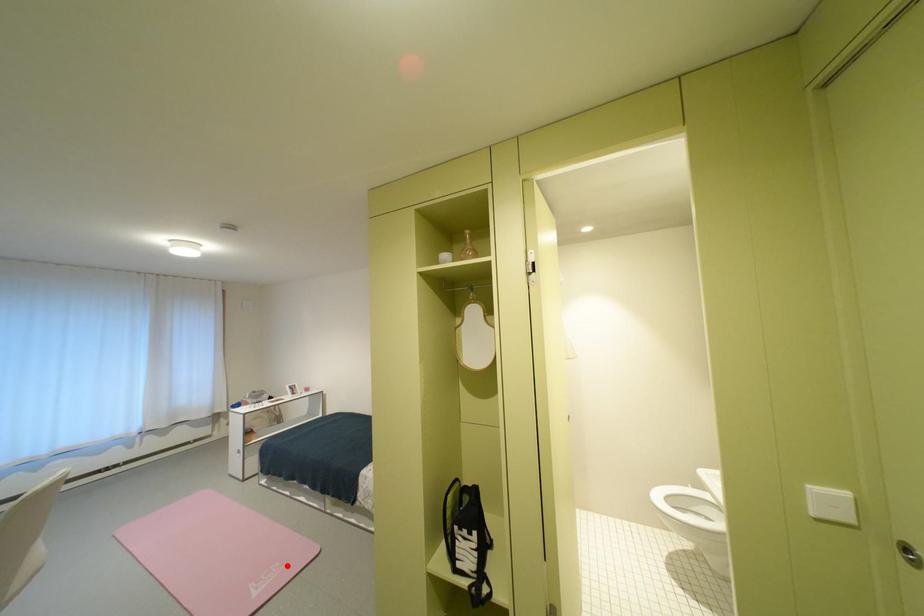
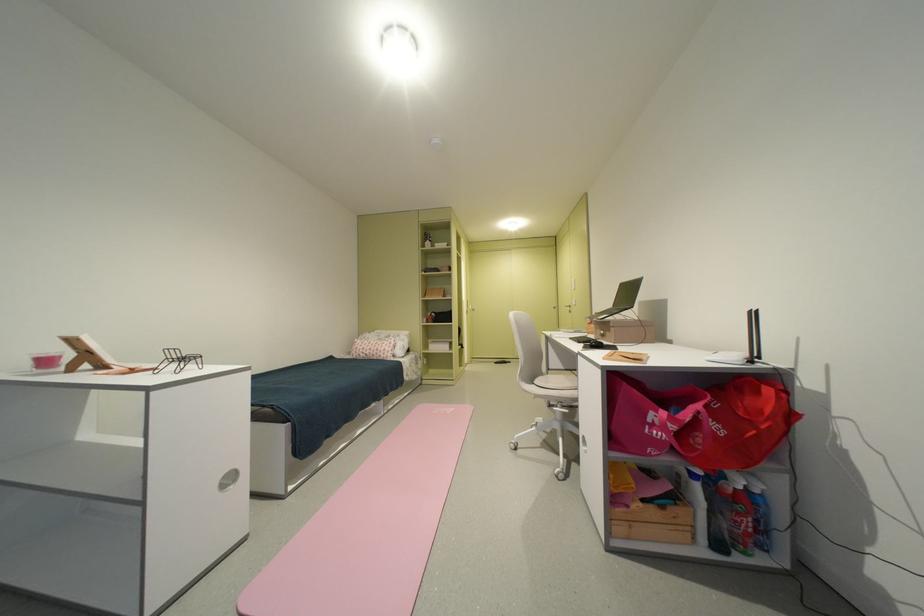
Question: I am providing you with two images of the same scene from different viewpoints. Image1 has a red point marked. In image2, the corresponding 3D location appears at what relative position? Reply with the corresponding letter.

Choices:
 (A) Closer
 (B) Farther

Answer: (B)